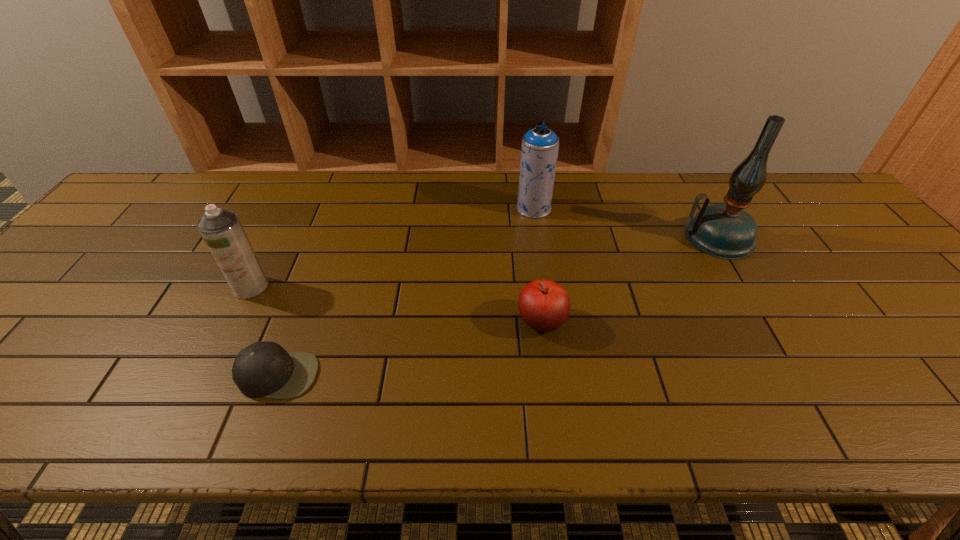
The image size is (960, 540). I want to click on free spot located 0.280m on the front of the right aerosol can, so click(x=545, y=288).

Identify the location of free spot located on the left of the leftmost object. [182, 287].

Where is `vacant area located on the left of the fourth farthest object`? The width and height of the screenshot is (960, 540). vacant area located on the left of the fourth farthest object is located at coordinates (396, 322).

You are a GUI agent. You are given a task and a screenshot of the screen. Output one action in this format:
    pyautogui.click(x=<x>, y=<y>)
    Task: Click on the vacant space located on the brim of the shortest object
    
    Given the screenshot: What is the action you would take?
    pyautogui.click(x=260, y=423)

Image resolution: width=960 pixels, height=540 pixels. Find the location of `oil lamp positioned at the far edge`. oil lamp positioned at the far edge is located at coordinates (726, 231).

This screenshot has width=960, height=540. I want to click on aerosol can that is at the far edge, so click(539, 151).

Locate an element on the screen. object situated at the near edge is located at coordinates (265, 369).

At what (x,y) coordinates should I click in order to perform the action: click on free space at the far edge. Please return your answer as a coordinate pair (x, y). Looking at the image, I should click on (664, 192).

This screenshot has height=540, width=960. In the image, there is a desktop. What are the coordinates of `vacant space at the near edge` in the screenshot? It's located at (592, 423).

Identify the location of vacant space at the left edge of the desktop. (40, 348).